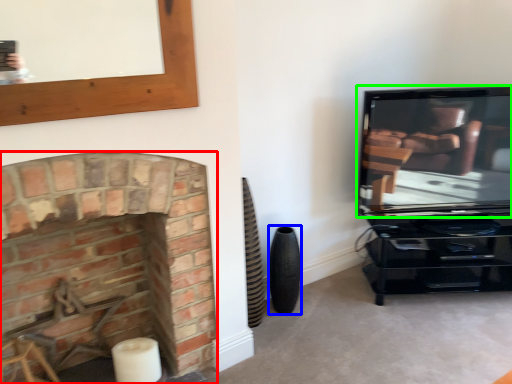
Question: Estimate the real-world distances between objects in this image. Which object is farther from fireplace (highlighted by a red box), speaker (highlighted by a blue box) or television (highlighted by a green box)?

Choices:
 (A) speaker
 (B) television

Answer: (B)